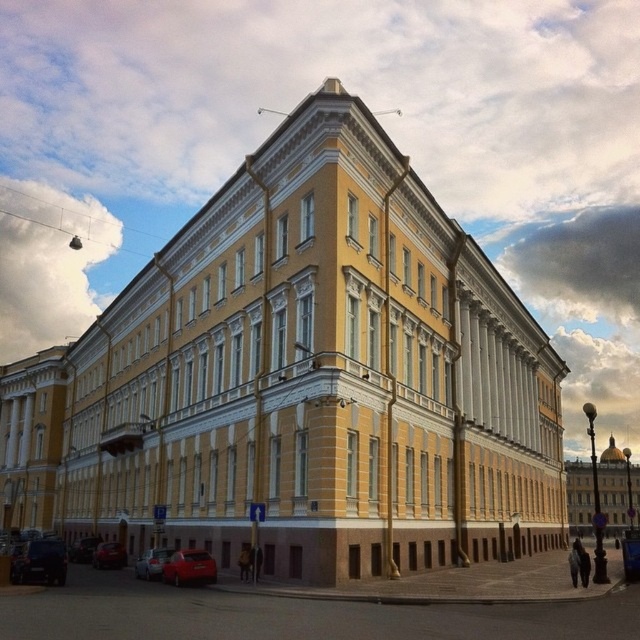
Question: Is shiny red car at lower left wider than metallic red car at lower left?

Choices:
 (A) yes
 (B) no

Answer: (B)

Question: Which object is the closest to the metallic red car at lower left?

Choices:
 (A) shiny red car at lower left
 (B) yellow stone building at center
 (C) shiny black car at lower left
 (D) yellow brick building at center

Answer: (A)

Question: Can you confirm if yellow stone building at center is positioned to the right of metallic red car at lower left?

Choices:
 (A) no
 (B) yes

Answer: (B)

Question: Which object is the closest to the shiny black car at lower left?

Choices:
 (A) yellow brick building at center
 (B) shiny red car at lower left
 (C) yellow stone building at center
 (D) matte red car at lower left

Answer: (D)

Question: Which object is positioned farthest from the yellow brick building at center?

Choices:
 (A) shiny black car at lower left
 (B) yellow stone building at center
 (C) shiny red sedan at lower left
 (D) shiny red car at lower left

Answer: (B)

Question: Is yellow stone building at center wider than shiny red car at lower left?

Choices:
 (A) yes
 (B) no

Answer: (A)